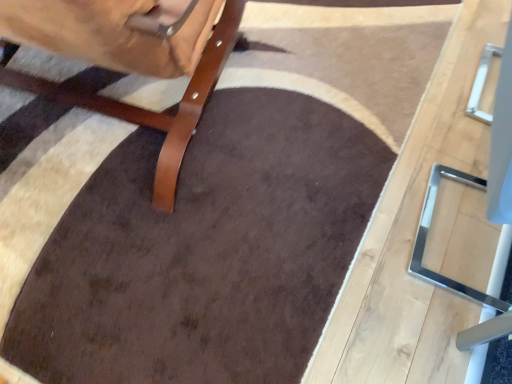
Question: Considering the relative sizes of metallic silver table at right and brown leather chair at left in the image provided, is metallic silver table at right wider than brown leather chair at left?

Choices:
 (A) no
 (B) yes

Answer: (A)

Question: From the image's perspective, is metallic silver table at right under brown leather chair at left?

Choices:
 (A) no
 (B) yes

Answer: (B)

Question: Does metallic silver table at right appear on the left side of brown leather chair at left?

Choices:
 (A) no
 (B) yes

Answer: (A)

Question: From a real-world perspective, is metallic silver table at right beneath brown leather chair at left?

Choices:
 (A) yes
 (B) no

Answer: (A)

Question: From the image's perspective, is metallic silver table at right on top of brown leather chair at left?

Choices:
 (A) no
 (B) yes

Answer: (A)

Question: Considering the relative sizes of metallic silver table at right and brown leather chair at left in the image provided, is metallic silver table at right bigger than brown leather chair at left?

Choices:
 (A) yes
 (B) no

Answer: (B)

Question: From a real-world perspective, does brown leather chair at left stand above metallic silver table at right?

Choices:
 (A) no
 (B) yes

Answer: (B)

Question: Is brown leather chair at left bigger than metallic silver table at right?

Choices:
 (A) yes
 (B) no

Answer: (A)

Question: Does brown leather chair at left appear on the left side of metallic silver table at right?

Choices:
 (A) no
 (B) yes

Answer: (B)

Question: Can you see brown leather chair at left touching metallic silver table at right?

Choices:
 (A) no
 (B) yes

Answer: (A)

Question: Considering the relative sizes of brown leather chair at left and metallic silver table at right in the image provided, is brown leather chair at left smaller than metallic silver table at right?

Choices:
 (A) no
 (B) yes

Answer: (A)

Question: Considering the relative positions of brown leather chair at left and metallic silver table at right in the image provided, is brown leather chair at left to the right of metallic silver table at right from the viewer's perspective?

Choices:
 (A) yes
 (B) no

Answer: (B)

Question: Considering the positions of metallic silver table at right and brown leather chair at left in the image, is metallic silver table at right bigger or smaller than brown leather chair at left?

Choices:
 (A) big
 (B) small

Answer: (B)